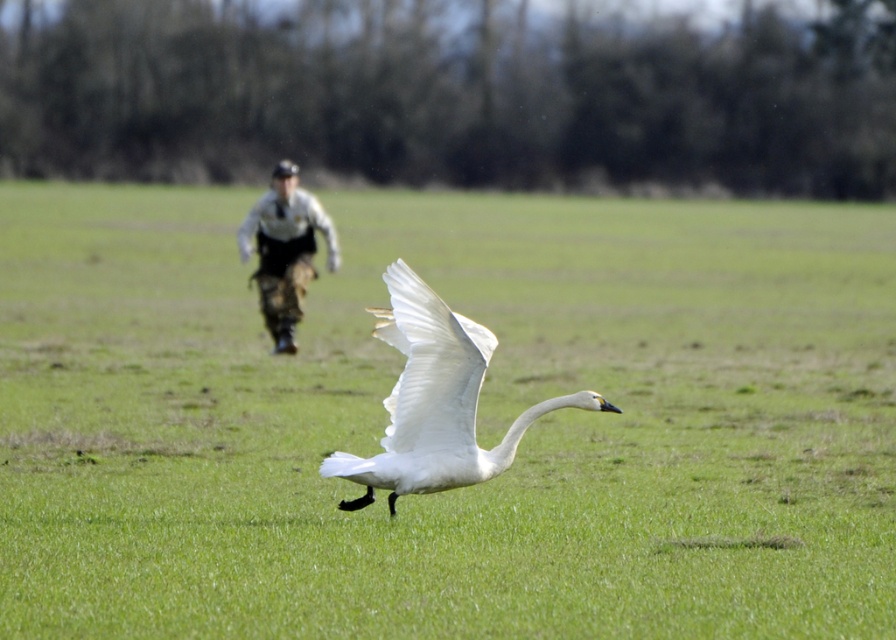
You are a photographer trying to capture a clear shot of the camouflage pants at center. However, the white glossy swan at center is blocking your view. Can you determine if the swan is closer to you or farther away compared to the camouflage pants?

The white glossy swan at center is closer to the viewer than the camouflage pants at center, so it is blocking the view of the camouflage pants at center.

You are a photographer trying to capture the white glossy swan at center while standing on the green grassy field at center. Can you safely walk towards the swan without stepping on the grass?

The green grassy field at center is closer to the viewer than the white glossy swan at center, so you cannot walk towards the swan without stepping on the grass since the grass is between you and the swan.